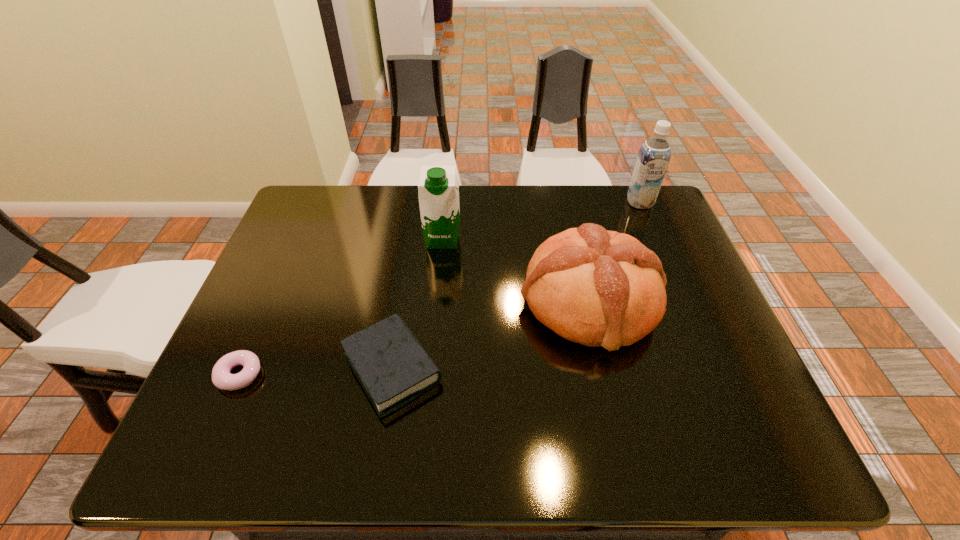
Identify the location of blank space at the left edge. The height and width of the screenshot is (540, 960). (227, 417).

This screenshot has width=960, height=540. I want to click on vacant space at the right edge, so click(648, 243).

Locate an element on the screen. The height and width of the screenshot is (540, 960). vacant space at the far left corner of the desktop is located at coordinates (311, 195).

Find the location of `vacant region between the Bible and the second farthest object`. vacant region between the Bible and the second farthest object is located at coordinates (418, 303).

This screenshot has height=540, width=960. What are the coordinates of `empty location between the shortest object and the right soya milk` in the screenshot? It's located at (440, 288).

Where is `unoccupied position between the right soya milk and the fourth tallest object`? This screenshot has width=960, height=540. unoccupied position between the right soya milk and the fourth tallest object is located at coordinates (516, 285).

Locate an element on the screen. vacant space that is in between the third tallest object and the doughnut is located at coordinates (415, 338).

Where is `free space that is in between the Bible and the nearer soya milk`? Image resolution: width=960 pixels, height=540 pixels. free space that is in between the Bible and the nearer soya milk is located at coordinates pyautogui.click(x=418, y=303).

Where is `vacant space that is in between the shortest object and the farthest object`? vacant space that is in between the shortest object and the farthest object is located at coordinates (440, 288).

Where is `free space between the third tallest object and the fourth tallest object`? free space between the third tallest object and the fourth tallest object is located at coordinates (492, 335).